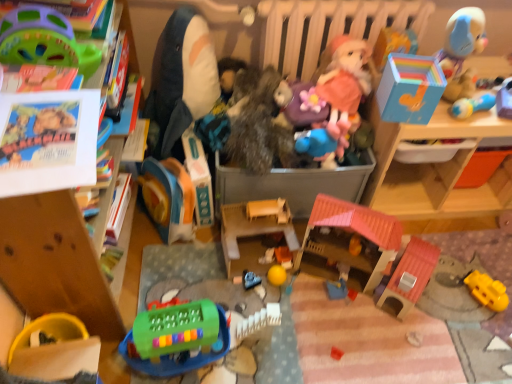
Question: Is smooth blue car at center, arranged as the sixth toy when viewed from the left, spatially inside smooth plastic ball at upper right, marked as the 16th toy in a left-to-right arrangement, or outside of it?

Choices:
 (A) inside
 (B) outside

Answer: (B)

Question: Does point (249, 274) appear closer or farther from the camera than point (508, 84)?

Choices:
 (A) farther
 (B) closer

Answer: (A)

Question: Estimate the real-world distances between objects in this image. Which object is farther from the green plastic steering wheel at upper left, marked as the 14th toy in a right-to-left arrangement?

Choices:
 (A) green plastic keyboard at lower left, the twelfth toy viewed from the right
 (B) smooth orange block at center, arranged as the seventh toy when viewed from the right
 (C) yellow plastic blocks at lower right, the 2th toy from the right
 (D) fuzzy fabric stuffed animal at center, placed as the seventh toy when sorted from left to right
 (E) pink fabric doll at center, positioned as the 11th toy in left-to-right order

Answer: (C)

Question: Which is nearer to the rubber yellow bowl at lower left, arranged as the first toy when viewed from the left?

Choices:
 (A) wooden farm at center, the eighth toy viewed from the left
 (B) smooth orange block at center, the tenth toy positioned from the left
 (C) metallic gray storage box at center, which is the second storage box in right-to-left order
 (D) green plastic steering wheel at upper left, positioned as the 3th toy in left-to-right order
 (E) pink fabric doll at center, positioned as the 11th toy in left-to-right order

Answer: (A)